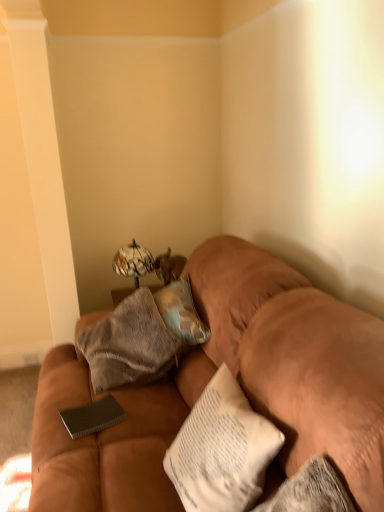
What do you see at coordinates (92, 417) in the screenshot? I see `black textured notebook at center` at bounding box center [92, 417].

Identify the location of textured beige pillow at center. The width and height of the screenshot is (384, 512). (181, 312).

Describe the element at coordinates (238, 381) in the screenshot. I see `suede brown couch at center` at that location.

Find the location of a particular element. black textured notebook at center is located at coordinates (92, 417).

Can you tell me how much marble-patterned glass table lamp at upper center and black textured notebook at center differ in facing direction?

The angular difference between marble-patterned glass table lamp at upper center and black textured notebook at center is 66.9 degrees.

Considering the sizes of marble-patterned glass table lamp at upper center and black textured notebook at center in the image, is marble-patterned glass table lamp at upper center wider or thinner than black textured notebook at center?

Clearly, marble-patterned glass table lamp at upper center has more width compared to black textured notebook at center.

You are a GUI agent. You are given a task and a screenshot of the screen. Output one action in this format:
    pyautogui.click(x=<x>, y=<y>)
    Task: Click on the pad that is on the left side of marble-patterned glass table lamp at upper center
    This screenshot has width=384, height=512.
    Given the screenshot: What is the action you would take?
    pyautogui.click(x=92, y=417)

Considering the sizes of objects marble-patterned glass table lamp at upper center and black textured notebook at center in the image provided, who is smaller, marble-patterned glass table lamp at upper center or black textured notebook at center?

Smaller between the two is black textured notebook at center.

From the image's perspective, is textured beige pillow at center above or below marble-patterned glass table lamp at upper center?

Based on their image positions, textured beige pillow at center is located beneath marble-patterned glass table lamp at upper center.

Is textured beige pillow at center in front of or behind marble-patterned glass table lamp at upper center in the image?

textured beige pillow at center is in front of marble-patterned glass table lamp at upper center.

Considering the positions of point (180, 291) and point (122, 253), is point (180, 291) closer or farther from the camera than point (122, 253)?

Point (180, 291) is closer to the camera than point (122, 253).

Would you say textured beige pillow at center is a long distance from marble-patterned glass table lamp at upper center?

textured beige pillow at center is actually quite close to marble-patterned glass table lamp at upper center.

How many degrees apart are the facing directions of black textured notebook at center and marble-patterned glass table lamp at upper center?

66.9 degrees.

Considering the points (85, 416) and (120, 267), which point is behind, point (85, 416) or point (120, 267)?

The point (120, 267) is more distant.

Considering the sizes of black textured notebook at center and marble-patterned glass table lamp at upper center in the image, is black textured notebook at center taller or shorter than marble-patterned glass table lamp at upper center?

Considering their sizes, black textured notebook at center has less height than marble-patterned glass table lamp at upper center.

Is black textured notebook at center next to textured beige pillow at center?

No, black textured notebook at center is not beside textured beige pillow at center.

Does black textured notebook at center have a greater height compared to textured beige pillow at center?

No, black textured notebook at center is not taller than textured beige pillow at center.

From the image's perspective, who appears lower, black textured notebook at center or textured beige pillow at center?

black textured notebook at center.

Does point (116, 403) come in front of point (183, 326)?

Yes.

From a real-world perspective, is marble-patterned glass table lamp at upper center physically located above or below suede brown couch at center?

marble-patterned glass table lamp at upper center is above suede brown couch at center.

Are marble-patterned glass table lamp at upper center and suede brown couch at center far apart?

Indeed, marble-patterned glass table lamp at upper center is not near suede brown couch at center.

Which is behind, marble-patterned glass table lamp at upper center or suede brown couch at center?

marble-patterned glass table lamp at upper center is further away from the camera.

Is marble-patterned glass table lamp at upper center looking in the opposite direction of suede brown couch at center?

No.

From a real-world perspective, who is located lower, black textured notebook at center or suede brown couch at center?

black textured notebook at center, from a real-world perspective.

From the picture: Who is more distant, black textured notebook at center or suede brown couch at center?

black textured notebook at center is further away from the camera.

Is black textured notebook at center not inside suede brown couch at center?

No, black textured notebook at center is not outside of suede brown couch at center.

Considering the relative sizes of black textured notebook at center and suede brown couch at center in the image provided, is black textured notebook at center thinner than suede brown couch at center?

Yes.

Which is behind, suede brown couch at center or black textured notebook at center?

black textured notebook at center is behind.

From the image's perspective, relative to black textured notebook at center, is suede brown couch at center above or below?

suede brown couch at center is above black textured notebook at center.

How many degrees apart are the facing directions of suede brown couch at center and black textured notebook at center?

They differ by 19.8 degrees in their facing directions.

Is suede brown couch at center inside or outside of black textured notebook at center?

suede brown couch at center is outside black textured notebook at center.

Where is `table lamp behind the black textured notebook at center`? table lamp behind the black textured notebook at center is located at coordinates (133, 262).

At what (x,y) coordinates should I click in order to perform the action: click on table lamp below the textured beige pillow at center (from a real-world perspective). Please return your answer as a coordinate pair (x, y). This screenshot has height=512, width=384. Looking at the image, I should click on (133, 262).

When comparing their distances from marble-patterned glass table lamp at upper center, does black textured notebook at center or suede brown couch at center seem further?

Based on the image, black textured notebook at center appears to be further to marble-patterned glass table lamp at upper center.

Which object lies further to the anchor point marble-patterned glass table lamp at upper center, black textured notebook at center or textured beige pillow at center?

The object further to marble-patterned glass table lamp at upper center is black textured notebook at center.

From the image, which object appears to be nearer to textured beige pillow at center, black textured notebook at center or suede brown couch at center?

The object closer to textured beige pillow at center is suede brown couch at center.

From the image, which object appears to be farther from suede brown couch at center, textured beige pillow at center or black textured notebook at center?

black textured notebook at center is positioned further to the anchor suede brown couch at center.

Which object lies further to the anchor point suede brown couch at center, marble-patterned glass table lamp at upper center or black textured notebook at center?

Based on the image, marble-patterned glass table lamp at upper center appears to be further to suede brown couch at center.

When comparing their distances from marble-patterned glass table lamp at upper center, does suede brown couch at center or black textured notebook at center seem further?

Among the two, black textured notebook at center is located further to marble-patterned glass table lamp at upper center.

From the image, which object appears to be farther from suede brown couch at center, black textured notebook at center or textured beige pillow at center?

Based on the image, black textured notebook at center appears to be further to suede brown couch at center.

Looking at the image, which one is located closer to black textured notebook at center, marble-patterned glass table lamp at upper center or textured beige pillow at center?

Based on the image, textured beige pillow at center appears to be nearer to black textured notebook at center.

This screenshot has height=512, width=384. In order to click on pillow between suede brown couch at center and marble-patterned glass table lamp at upper center along the z-axis in this screenshot , I will do `click(181, 312)`.

This screenshot has height=512, width=384. I want to click on pad between suede brown couch at center and marble-patterned glass table lamp at upper center along the z-axis, so click(x=92, y=417).

This screenshot has width=384, height=512. In order to click on pad between suede brown couch at center and textured beige pillow at center in the front-back direction in this screenshot , I will do `click(92, 417)`.

This screenshot has height=512, width=384. In order to click on pillow between black textured notebook at center and marble-patterned glass table lamp at upper center along the z-axis in this screenshot , I will do `click(181, 312)`.